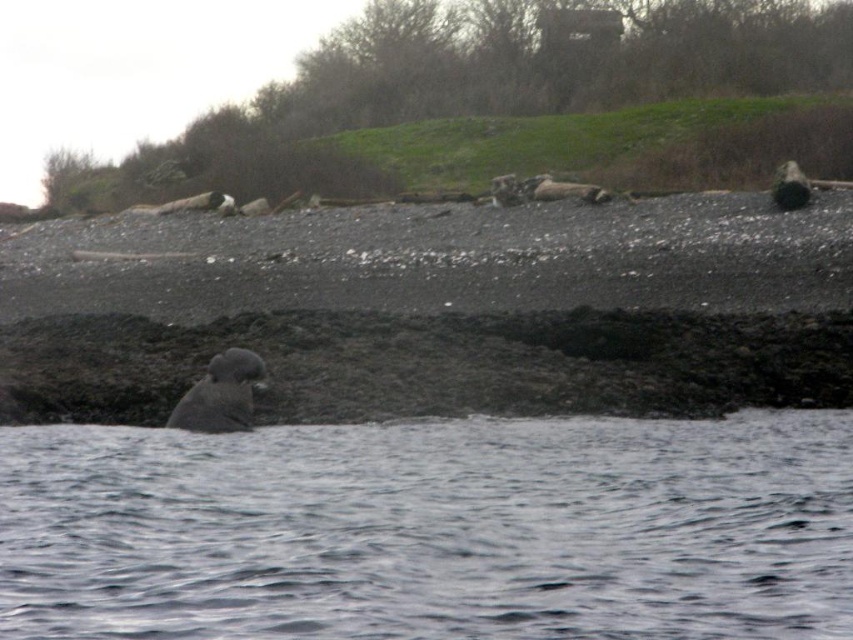
Question: Is clear water at lower center closer to the viewer compared to gray fur seal at center?

Choices:
 (A) no
 (B) yes

Answer: (B)

Question: Among these objects, which one is farthest from the camera?

Choices:
 (A) clear water at lower center
 (B) gray fur seal at center

Answer: (B)

Question: Does clear water at lower center lie behind gray fur seal at center?

Choices:
 (A) yes
 (B) no

Answer: (B)

Question: Can you confirm if clear water at lower center is positioned to the left of gray fur seal at center?

Choices:
 (A) yes
 (B) no

Answer: (B)

Question: Among these objects, which one is nearest to the camera?

Choices:
 (A) clear water at lower center
 (B) gray fur seal at center

Answer: (A)